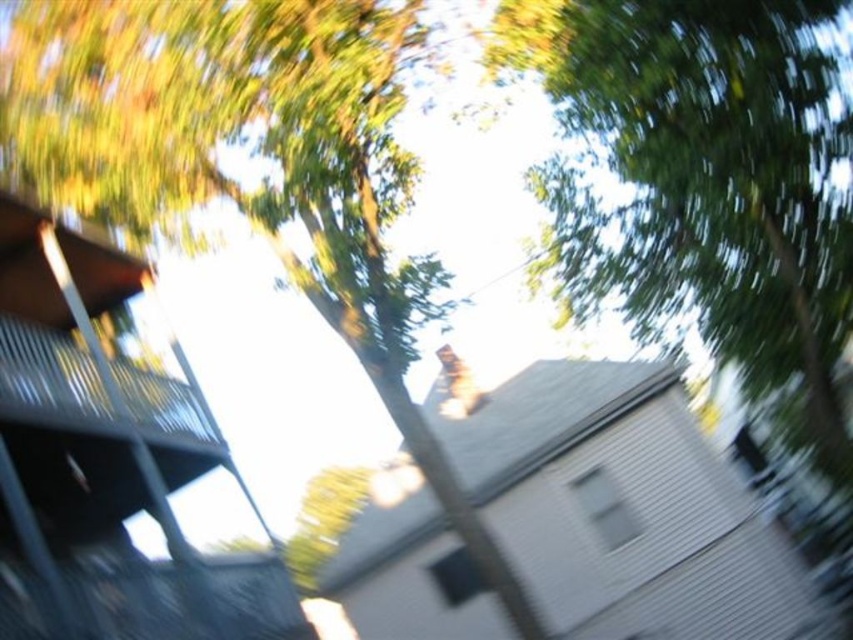
Question: Which point is farther to the camera?

Choices:
 (A) pyautogui.click(x=456, y=529)
 (B) pyautogui.click(x=105, y=604)

Answer: (A)

Question: Is green leafy tree at upper center to the left of metallic gray balcony at left from the viewer's perspective?

Choices:
 (A) no
 (B) yes

Answer: (A)

Question: Which point is closer to the camera?

Choices:
 (A) green leafy tree at upper center
 (B) metallic gray balcony at left

Answer: (B)

Question: Is the position of green leafy tree at upper center more distant than that of metallic gray balcony at left?

Choices:
 (A) yes
 (B) no

Answer: (A)

Question: Which of the following is the closest to the observer?

Choices:
 (A) metallic gray balcony at left
 (B) green leafy tree at upper center

Answer: (A)

Question: Does green leafy tree at upper center appear on the left side of metallic gray balcony at left?

Choices:
 (A) yes
 (B) no

Answer: (B)